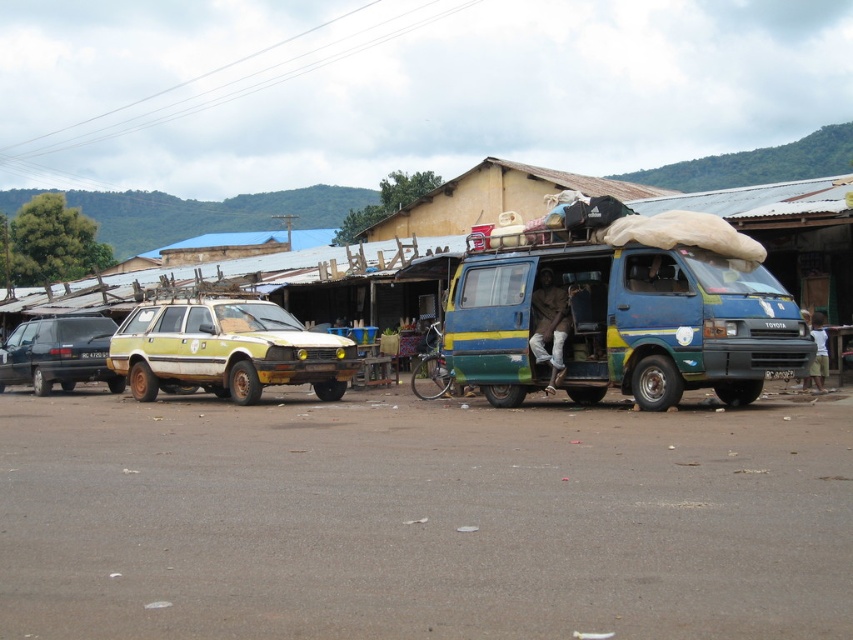
You are a delivery driver who needs to park your truck between the dirty yellow car at left and the matte black minivan at left. Your truck is 12 feet long. Can you safely park your truck between them without overlapping either vehicle?

The distance between the dirty yellow car at left and the matte black minivan at left is 13.17 feet. Since your truck is 12 feet long, there is enough space to park safely between them without overlapping either vehicle.

You are a pedestrian standing at the roadside and see the blue painted metal van at center and the dirty yellow car at left. Which vehicle is closer to the right side of the road?

The blue painted metal van at center is to the right of the dirty yellow car at left, so it is closer to the right side of the road.

You are a delivery driver who needs to park your vehicle between the blue painted metal van at center and the matte black minivan at left. Is there enough space for your vehicle?

The blue painted metal van at center is positioned over the matte black minivan at left, meaning there is no space between them. Therefore, there is insufficient space to park your vehicle between them.